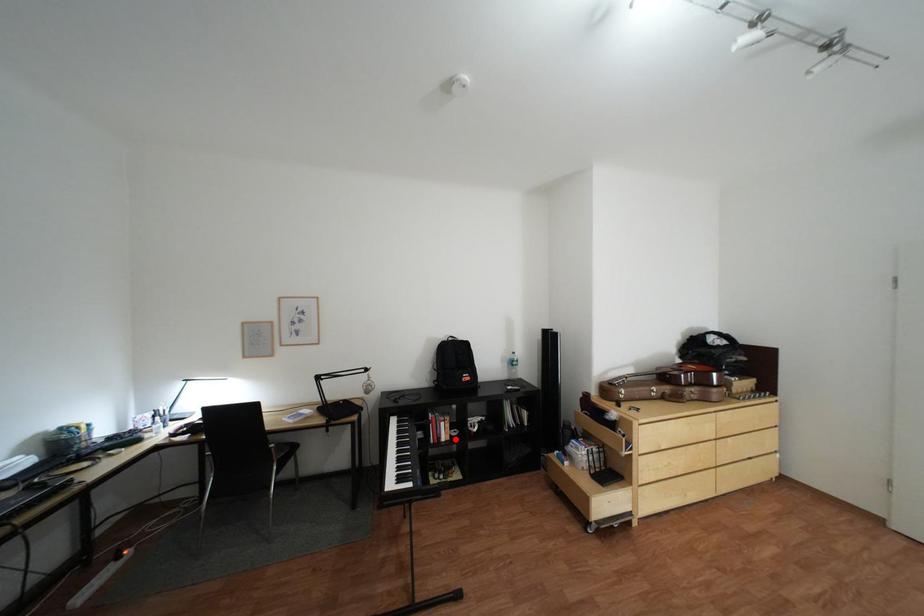
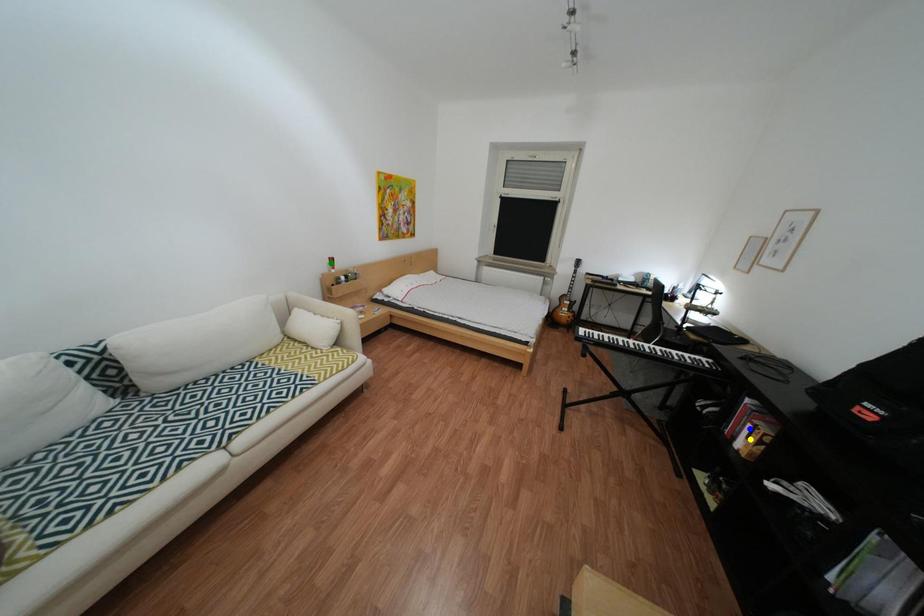
Question: I am providing you with two images of the same scene from different viewpoints. A red point is marked on the first image. You are given multiple points on the second image. In image 2, which mark is for the same physical point as the one in image 1?

Choices:
 (A) yellow point
 (B) blue point
 (C) green point

Answer: (A)